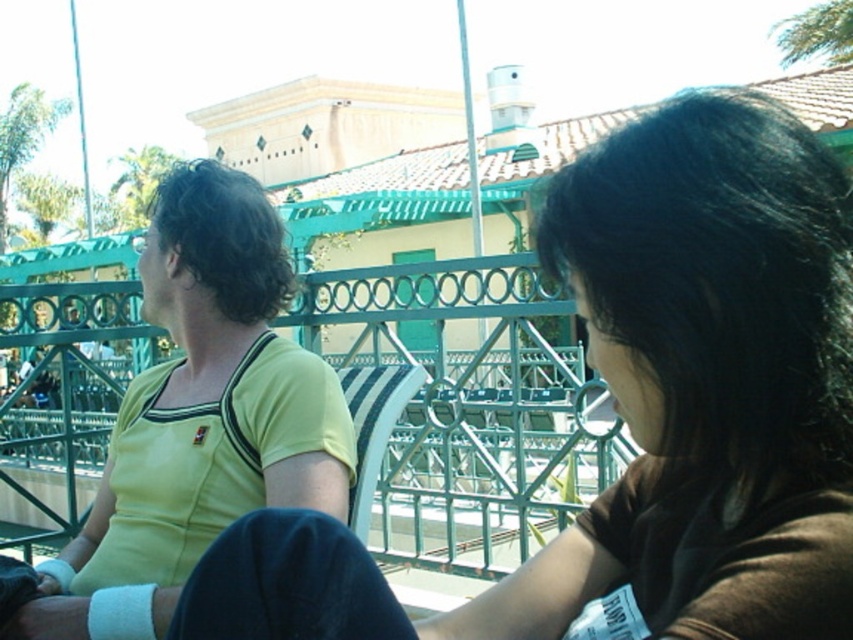
Question: Which of these objects is positioned farthest from the yellow matte shirt at upper left?

Choices:
 (A) dark brown hair at upper right
 (B) yellow jersey at left

Answer: (B)

Question: Which of these objects is positioned farthest from the yellow jersey at left?

Choices:
 (A) dark brown hair at upper right
 (B) yellow matte shirt at upper left

Answer: (A)

Question: Is yellow matte shirt at upper left to the right of yellow jersey at left from the viewer's perspective?

Choices:
 (A) no
 (B) yes

Answer: (B)

Question: Is the position of yellow matte shirt at upper left more distant than that of dark brown hair at upper right?

Choices:
 (A) no
 (B) yes

Answer: (A)

Question: Is yellow matte shirt at upper left to the left of dark brown hair at upper right from the viewer's perspective?

Choices:
 (A) no
 (B) yes

Answer: (B)

Question: Which object appears closest to the camera in this image?

Choices:
 (A) yellow jersey at left
 (B) yellow matte shirt at upper left

Answer: (B)